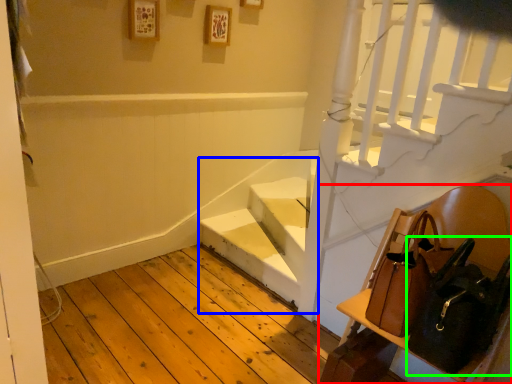
Question: Which object is positioned closest to furniture (highlighted by a red box)? Select from stairwell (highlighted by a blue box) and shoulder bag (highlighted by a green box).

Choices:
 (A) stairwell
 (B) shoulder bag

Answer: (B)